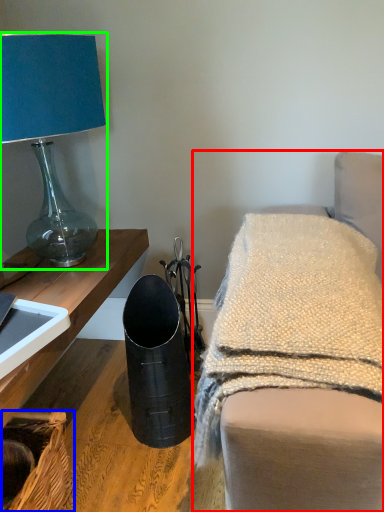
Question: Which object is the farthest from furniture (highlighted by a red box)? Choose among these: basket (highlighted by a blue box) or lamp (highlighted by a green box).

Choices:
 (A) basket
 (B) lamp

Answer: (B)